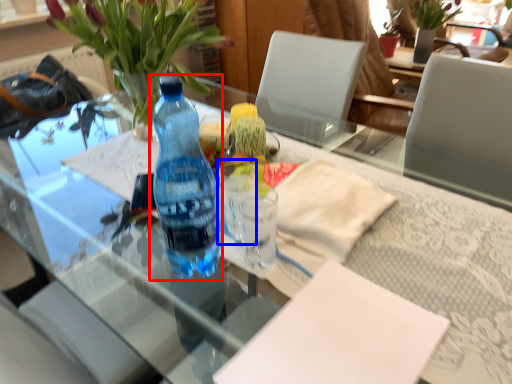
Question: Which point is closer to the camera, bottle (highlighted by a red box) or coffee cup (highlighted by a blue box)?

Choices:
 (A) bottle
 (B) coffee cup

Answer: (A)